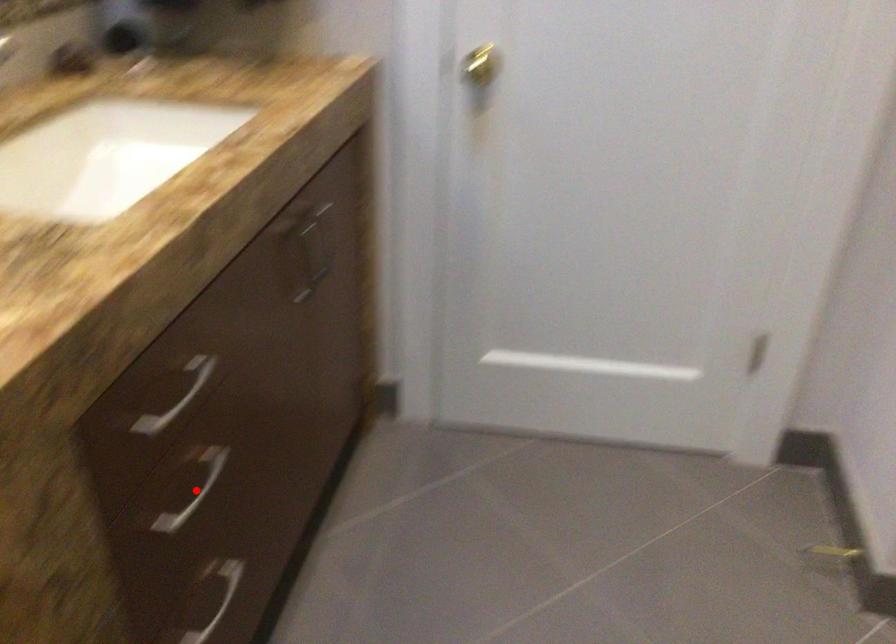
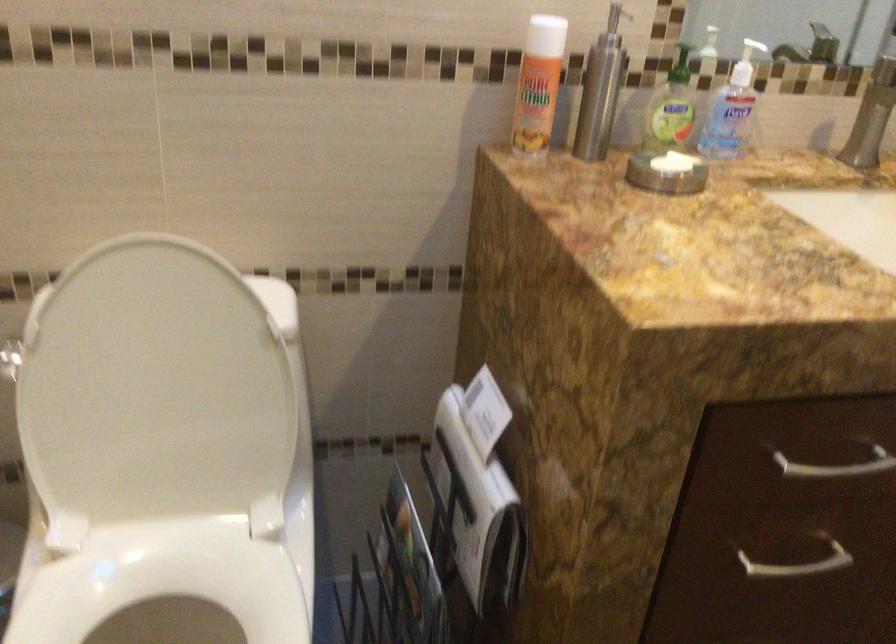
Find the pixel in the second image that matches the highlighted location in the first image.

(797, 565)